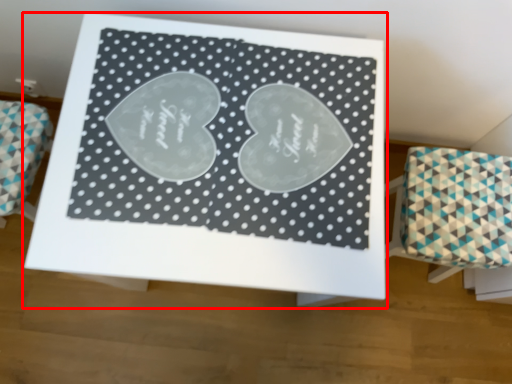
Question: From the image's perspective, what is the correct spatial relationship of table (annotated by the red box) in relation to furniture?

Choices:
 (A) above
 (B) below

Answer: (A)